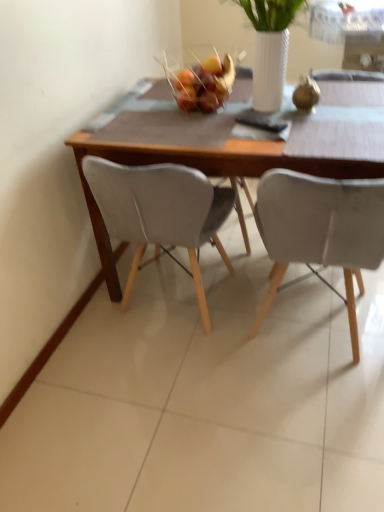
Question: Would you say wooden table at center is outside glossy plastic fruit basket at center?

Choices:
 (A) no
 (B) yes

Answer: (B)

Question: From the image's perspective, is wooden table at center beneath glossy plastic fruit basket at center?

Choices:
 (A) no
 (B) yes

Answer: (B)

Question: From a real-world perspective, is wooden table at center positioned under glossy plastic fruit basket at center based on gravity?

Choices:
 (A) no
 (B) yes

Answer: (B)

Question: Is wooden table at center directly adjacent to glossy plastic fruit basket at center?

Choices:
 (A) yes
 (B) no

Answer: (B)

Question: Is wooden table at center looking in the opposite direction of glossy plastic fruit basket at center?

Choices:
 (A) no
 (B) yes

Answer: (A)

Question: In terms of width, does glossy plastic fruit basket at center look wider or thinner when compared to white matte chair at right, marked as the second chair in a left-to-right arrangement?

Choices:
 (A) wide
 (B) thin

Answer: (B)

Question: From a real-world perspective, is glossy plastic fruit basket at center physically located above or below white matte chair at right, which is the first chair in right-to-left order?

Choices:
 (A) above
 (B) below

Answer: (A)

Question: Is point (215, 76) closer or farther from the camera than point (284, 202)?

Choices:
 (A) farther
 (B) closer

Answer: (A)

Question: Considering the positions of glossy plastic fruit basket at center and white matte chair at right, marked as the second chair in a left-to-right arrangement, in the image, is glossy plastic fruit basket at center taller or shorter than white matte chair at right, marked as the second chair in a left-to-right arrangement,?

Choices:
 (A) tall
 (B) short

Answer: (B)

Question: Relative to white matte chair at right, which is the first chair in right-to-left order, is wooden table at center in front or behind?

Choices:
 (A) behind
 (B) front

Answer: (A)

Question: In the image, is wooden table at center on the left side or the right side of white matte chair at right, marked as the second chair in a left-to-right arrangement?

Choices:
 (A) right
 (B) left

Answer: (B)

Question: Is wooden table at center bigger or smaller than white matte chair at right, marked as the second chair in a left-to-right arrangement?

Choices:
 (A) big
 (B) small

Answer: (A)

Question: From a real-world perspective, relative to white matte chair at right, marked as the second chair in a left-to-right arrangement, is wooden table at center vertically above or below?

Choices:
 (A) below
 (B) above

Answer: (A)

Question: From the image's perspective, is matte gray chair at center, placed as the first chair when sorted from left to right, positioned above or below wooden table at center?

Choices:
 (A) below
 (B) above

Answer: (A)

Question: Would you say matte gray chair at center, placed as the first chair when sorted from left to right, is to the left or to the right of wooden table at center in the picture?

Choices:
 (A) left
 (B) right

Answer: (A)